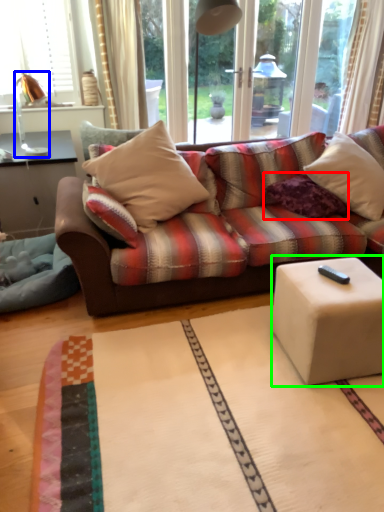
Question: Estimate the real-world distances between objects in this image. Which object is farther from pillow (highlighted by a red box), table lamp (highlighted by a blue box) or table (highlighted by a green box)?

Choices:
 (A) table lamp
 (B) table

Answer: (A)